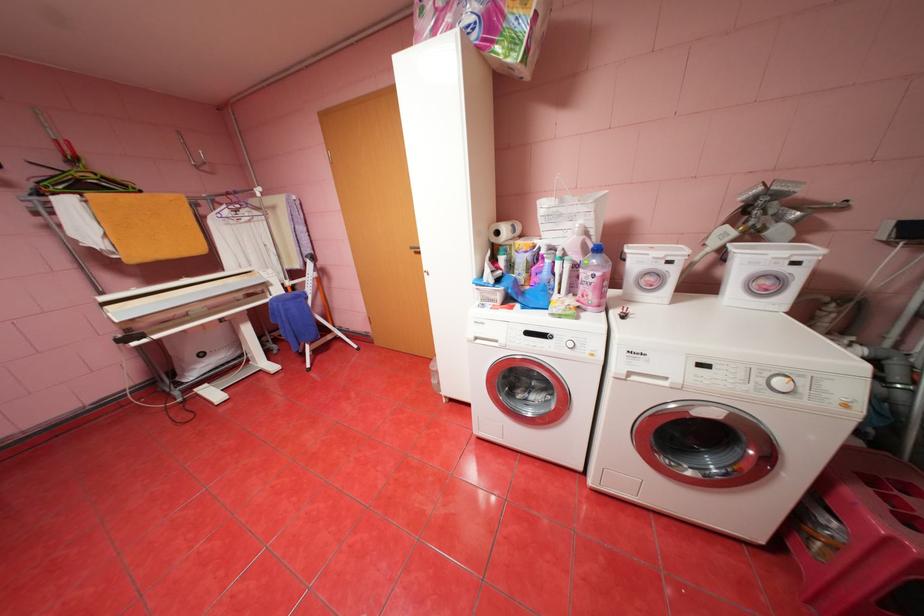
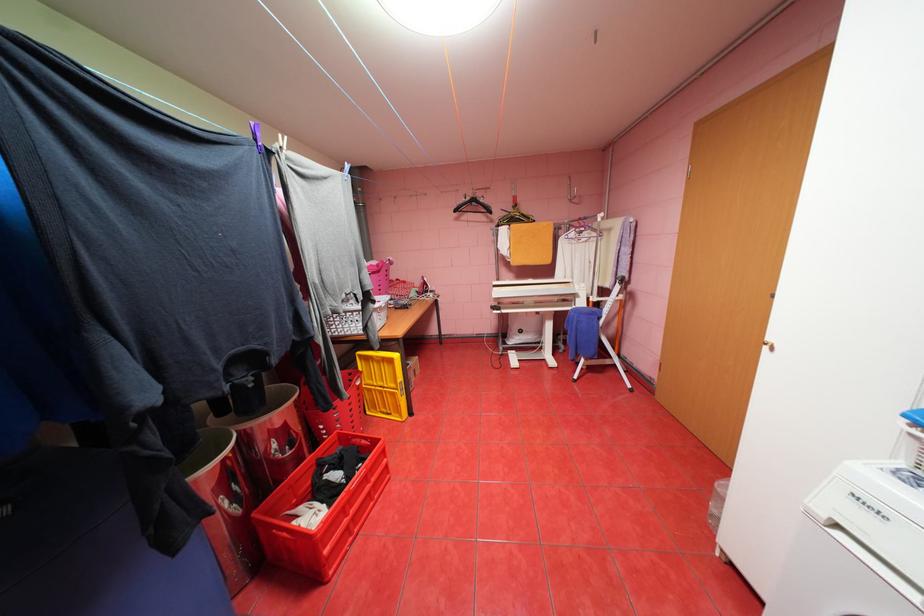
Where in the second image is the point corresponding to pixel 238 190 from the first image?

(591, 216)